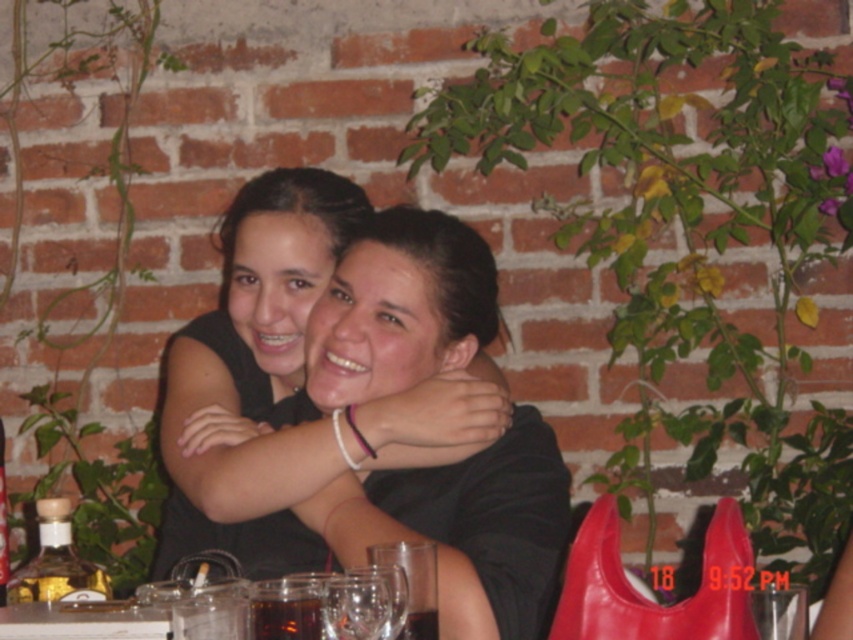
Can you confirm if translucent glass bottle at lower left is shorter than transparent glass wine glass at center?

No.

Which is more to the right, translucent glass bottle at lower left or transparent glass wine glass at center?

transparent glass wine glass at center

Image resolution: width=853 pixels, height=640 pixels. Describe the element at coordinates (57, 563) in the screenshot. I see `translucent glass bottle at lower left` at that location.

The image size is (853, 640). I want to click on translucent glass bottle at lower left, so click(x=57, y=563).

Does point (408, 561) lie behind point (780, 595)?

Yes, point (408, 561) is behind point (780, 595).

How far apart are transparent glass wine glass at center and transparent glass at center?

transparent glass wine glass at center and transparent glass at center are 10.25 inches apart from each other.

In order to click on transparent glass wine glass at center in this screenshot , I will do `click(413, 584)`.

Which is more to the right, transparent glass wine glass at center or transparent glass wine glass at lower center?

Positioned to the right is transparent glass wine glass at center.

Is point (397, 545) positioned in front of point (393, 579)?

No, (397, 545) is behind (393, 579).

Is point (427, 552) more distant than point (389, 627)?

Yes.

I want to click on transparent glass wine glass at center, so click(413, 584).